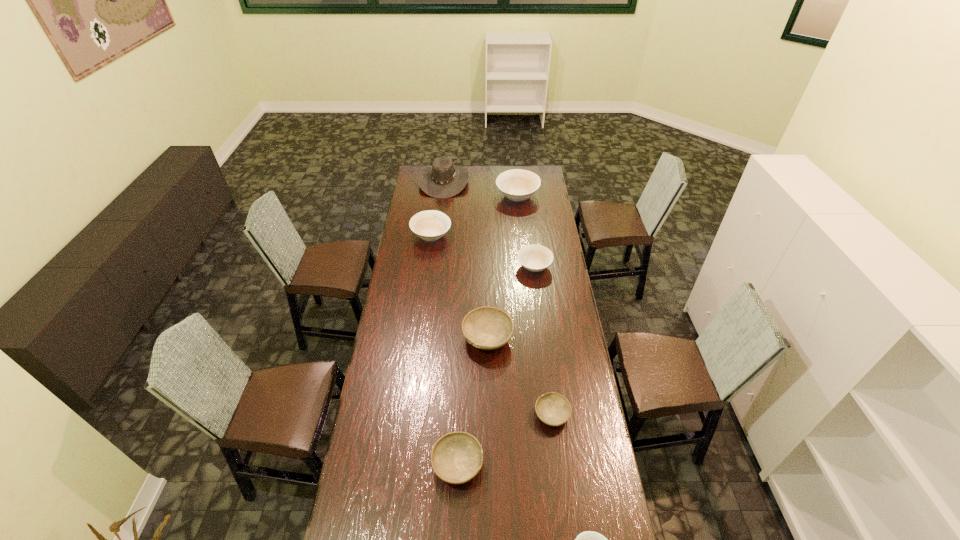
At what (x,y) coordinates should I click in order to perform the action: click on the second nearest bowl. Please return your answer as a coordinate pair (x, y). The image size is (960, 540). Looking at the image, I should click on (456, 458).

The width and height of the screenshot is (960, 540). In order to click on the third nearest object in this screenshot , I will do `click(553, 409)`.

Identify the location of the smallest gray bowl. [x=553, y=409].

Identify the location of vacant region located 0.160m on the front-facing side of the tallest object. (493, 181).

This screenshot has height=540, width=960. I want to click on vacant position located on the left of the tallest bowl, so click(471, 196).

This screenshot has height=540, width=960. In order to click on blank space located 0.130m on the back of the third farthest object in this screenshot , I will do `click(435, 210)`.

In order to click on vacant space located on the back of the biggest gray bowl in this screenshot , I will do `click(487, 272)`.

You are a GUI agent. You are given a task and a screenshot of the screen. Output one action in this format:
    pyautogui.click(x=<x>, y=<y>)
    Task: Click on the vacant point located 0.160m on the left of the fifth nearest bowl
    
    Given the screenshot: What is the action you would take?
    pyautogui.click(x=485, y=267)

The image size is (960, 540). In order to click on vacant space located 0.090m on the front of the second nearest object in this screenshot , I will do `click(455, 521)`.

The image size is (960, 540). I want to click on free location located on the left of the fifth farthest bowl, so click(505, 415).